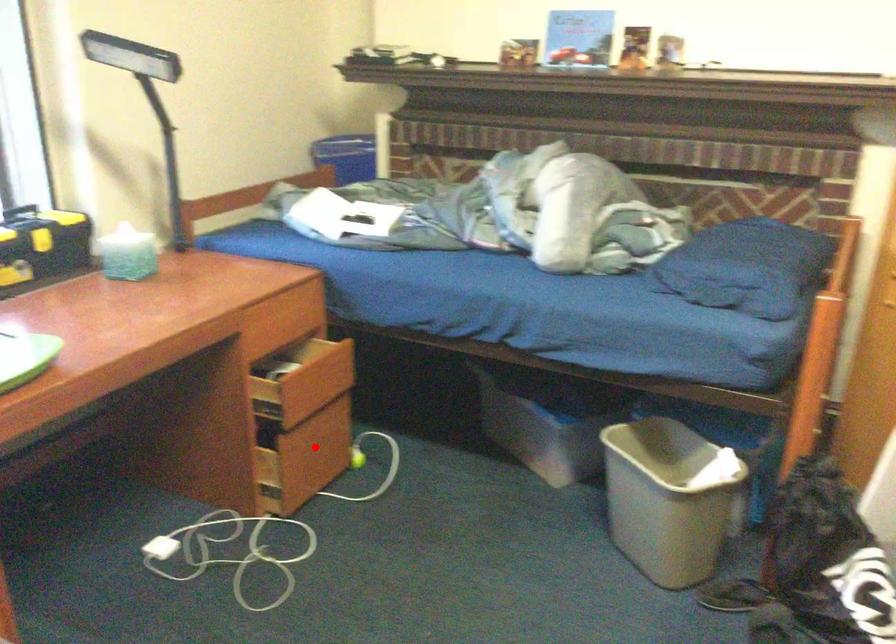
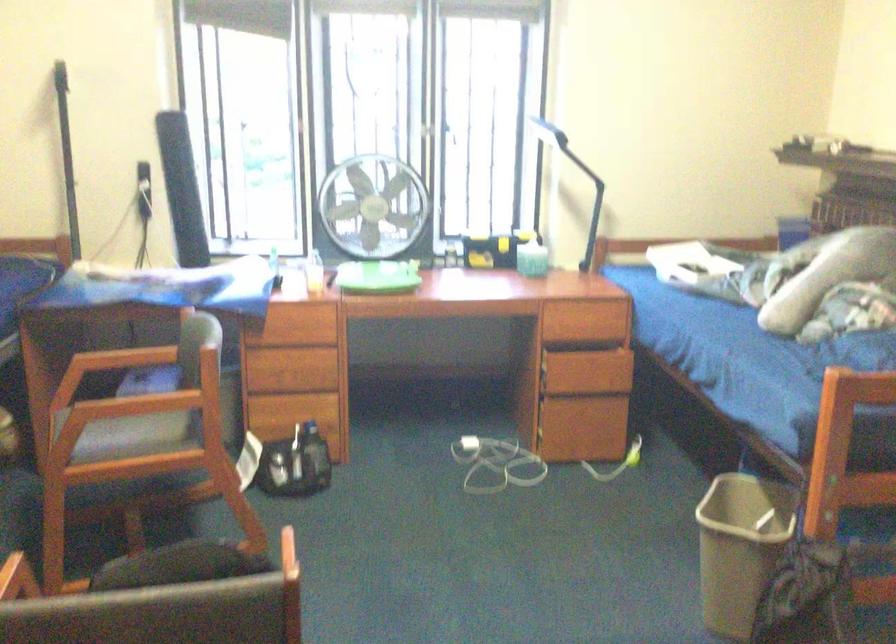
Question: I am providing you with two images of the same scene from different viewpoints. A red point is marked on the first image. At the location where the point appears in image 1, is it still visible in image 2?

Choices:
 (A) Yes
 (B) No

Answer: (A)